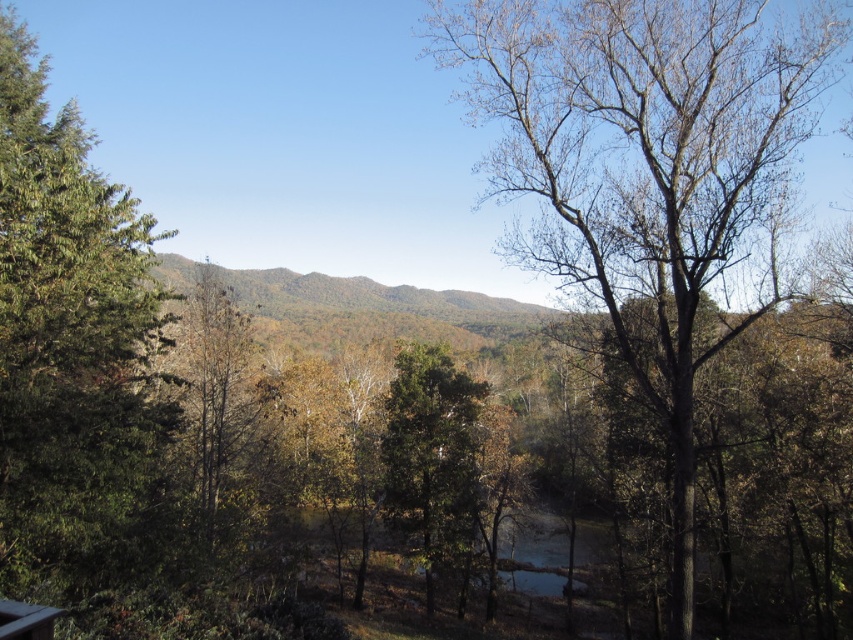
Question: Does bare wood tree at center appear on the left side of green leafy tree at left?

Choices:
 (A) yes
 (B) no

Answer: (B)

Question: Does green matte tree at center appear on the right side of white wood deck at lower left?

Choices:
 (A) no
 (B) yes

Answer: (B)

Question: Which is nearer to the green matte tree at center?

Choices:
 (A) white wood deck at lower left
 (B) bare wood tree at center

Answer: (B)

Question: From the image, what is the correct spatial relationship of bare wood tree at center in relation to green leafy tree at left?

Choices:
 (A) left
 (B) right

Answer: (B)

Question: Considering the real-world distances, which object is farthest from the green matte tree at center?

Choices:
 (A) bare wood tree at center
 (B) white wood deck at lower left

Answer: (B)

Question: Among these objects, which one is nearest to the camera?

Choices:
 (A) green leafy tree at left
 (B) white wood deck at lower left
 (C) bare wood tree at center

Answer: (B)